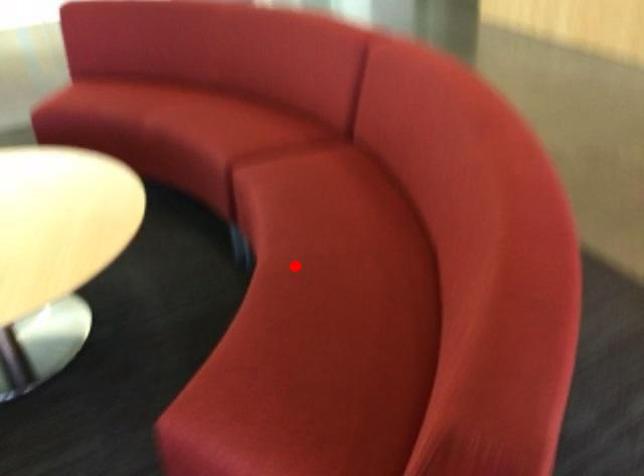
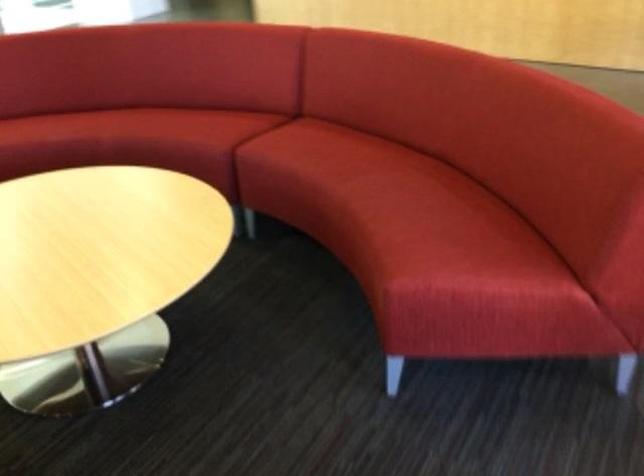
The point at the highlighted location is marked in the first image. Where is the corresponding point in the second image?

(370, 186)